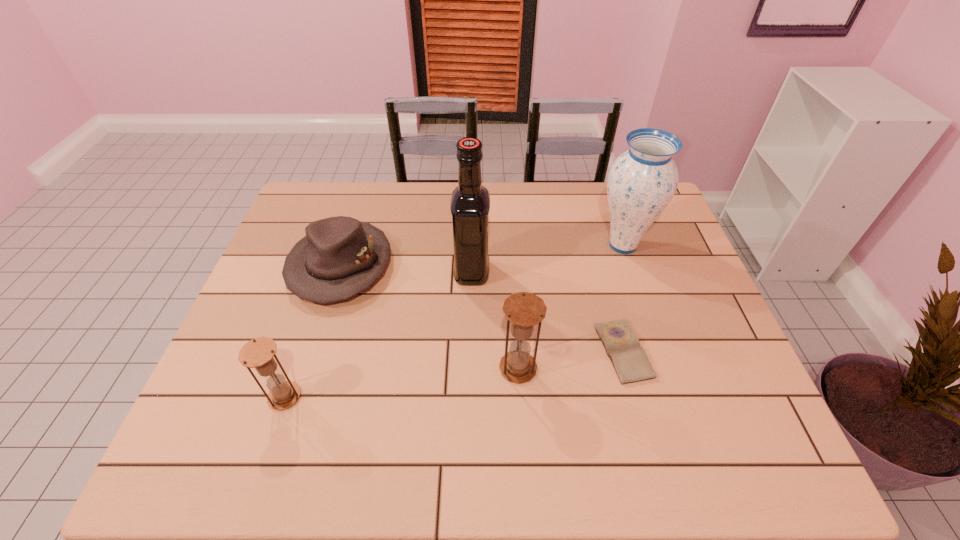
This screenshot has width=960, height=540. Identify the location of free space located on the decorative side of the fifth tallest object. (318, 336).

I want to click on vacant region located on the back of the vase, so click(x=609, y=202).

In order to click on free point located 0.290m on the front-facing side of the third object from left to right in this screenshot , I will do `click(590, 272)`.

Where is `free space located on the front of the diary`? free space located on the front of the diary is located at coordinates (637, 405).

The width and height of the screenshot is (960, 540). Find the location of `diary that is at the near edge`. diary that is at the near edge is located at coordinates (630, 361).

You are a GUI agent. You are given a task and a screenshot of the screen. Output one action in this format:
    pyautogui.click(x=<x>, y=<y>)
    Task: Click on the hourglass that is at the left edge
    
    Given the screenshot: What is the action you would take?
    pyautogui.click(x=258, y=353)

At what (x,y) coordinates should I click in order to perform the action: click on hat at the left edge. Please return your answer as a coordinate pair (x, y). This screenshot has width=960, height=540. Looking at the image, I should click on (339, 257).

Image resolution: width=960 pixels, height=540 pixels. Find the location of `object located in the right edge section of the desktop`. object located in the right edge section of the desktop is located at coordinates (642, 181).

This screenshot has height=540, width=960. I want to click on object located at the near left corner, so click(258, 353).

Find the location of a particular element. The image size is (960, 540). free space at the far edge is located at coordinates (359, 217).